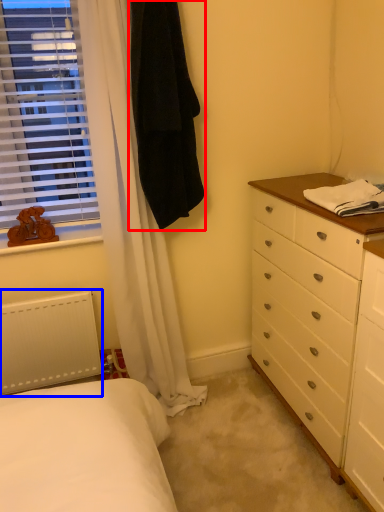
Question: Which point is closer to the camera, robe (highlighted by a red box) or radiator (highlighted by a blue box)?

Choices:
 (A) robe
 (B) radiator

Answer: (A)